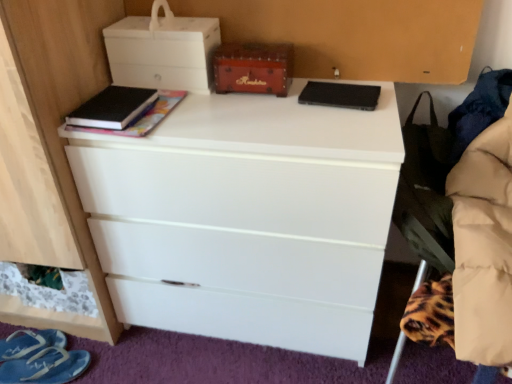
Find the location of a particular element. This screenshot has height=384, width=512. white matte storage box at upper left, which is counted as the first storage box, starting from the left is located at coordinates (162, 50).

How much space does blue fabric slipper at lower left, which is the 1th footwear in front-to-back order, occupy vertically?

4.83 centimeters.

This screenshot has width=512, height=384. Describe the element at coordinates (113, 108) in the screenshot. I see `black matte book at upper left, which ranks as the first book in left-to-right order` at that location.

Locate an element on the screen. The width and height of the screenshot is (512, 384). black matte book at upper left, acting as the 2th book starting from the right is located at coordinates (113, 108).

Identify the location of black fabric swivel chair at right. This screenshot has height=384, width=512. (440, 193).

Image resolution: width=512 pixels, height=384 pixels. Describe the element at coordinates (253, 68) in the screenshot. I see `wooden chest at center, marked as the second storage box in a left-to-right arrangement` at that location.

Locate an element on the screen. This screenshot has width=512, height=384. white matte storage box at upper left, positioned as the second storage box in right-to-left order is located at coordinates (162, 50).

Who is shorter, blue fabric slipper at lower left, positioned as the 2th footwear in back-to-front order, or wooden chest at center, placed as the 1th storage box when sorted from right to left?

blue fabric slipper at lower left, positioned as the 2th footwear in back-to-front order, is shorter.

Is there a large distance between blue fabric slipper at lower left, positioned as the 2th footwear in back-to-front order, and wooden chest at center, marked as the second storage box in a left-to-right arrangement?

Yes, blue fabric slipper at lower left, positioned as the 2th footwear in back-to-front order, is far from wooden chest at center, marked as the second storage box in a left-to-right arrangement.

Does blue fabric slipper at lower left, which is the 1th footwear in front-to-back order, come behind wooden chest at center, marked as the second storage box in a left-to-right arrangement?

Yes, it is behind wooden chest at center, marked as the second storage box in a left-to-right arrangement.

Is white matte storage box at upper left, which is counted as the first storage box, starting from the left, in contact with black matte book at upper left, which ranks as the first book in left-to-right order?

No, white matte storage box at upper left, which is counted as the first storage box, starting from the left, is not with black matte book at upper left, which ranks as the first book in left-to-right order.

The image size is (512, 384). Identify the location of the 1st storage box counting from the right side of the black matte book at upper left, which ranks as the first book in left-to-right order. (162, 50).

What's the angular difference between white matte storage box at upper left, positioned as the second storage box in right-to-left order, and black matte book at upper left, acting as the 2th book starting from the right,'s facing directions?

The angle between the facing direction of white matte storage box at upper left, positioned as the second storage box in right-to-left order, and the facing direction of black matte book at upper left, acting as the 2th book starting from the right, is 3.16 degrees.

Which is farther, (142, 59) or (133, 120)?

The point (142, 59) is farther from the camera.

What's the angular difference between black matte book at upper left, acting as the 2th book starting from the right, and blue fabric slipper at lower left, which is the 1th footwear in front-to-back order,'s facing directions?

The facing directions of black matte book at upper left, acting as the 2th book starting from the right, and blue fabric slipper at lower left, which is the 1th footwear in front-to-back order, are 106 degrees apart.

Does black matte book at upper left, acting as the 2th book starting from the right, touch blue fabric slipper at lower left, which is the 1th footwear in front-to-back order?

black matte book at upper left, acting as the 2th book starting from the right, and blue fabric slipper at lower left, which is the 1th footwear in front-to-back order, are not in contact.

Considering the relative sizes of black matte book at upper left, acting as the 2th book starting from the right, and blue fabric slipper at lower left, positioned as the 2th footwear in back-to-front order, in the image provided, is black matte book at upper left, acting as the 2th book starting from the right, shorter than blue fabric slipper at lower left, positioned as the 2th footwear in back-to-front order,?

Yes.

From a real-world perspective, which object stands above the other?

From a 3D spatial view, black matte book at upper left, acting as the 2th book starting from the right, is above.

How many degrees apart are the facing directions of blue fabric sandal at lower left, the first footwear positioned from the back, and black matte speaker at upper center, placed as the first book when sorted from right to left?

The angular difference between blue fabric sandal at lower left, the first footwear positioned from the back, and black matte speaker at upper center, placed as the first book when sorted from right to left, is 120 degrees.

From a real-world perspective, is blue fabric sandal at lower left, which ranks as the 2th footwear in front-to-back order, positioned under black matte speaker at upper center, placed as the first book when sorted from right to left, based on gravity?

Yes, from a real-world perspective, blue fabric sandal at lower left, which ranks as the 2th footwear in front-to-back order, is below black matte speaker at upper center, placed as the first book when sorted from right to left.

Is blue fabric sandal at lower left, the first footwear positioned from the back, beside black matte speaker at upper center, the second book viewed from the left?

There is a gap between blue fabric sandal at lower left, the first footwear positioned from the back, and black matte speaker at upper center, the second book viewed from the left.

Is blue fabric sandal at lower left, which ranks as the 2th footwear in front-to-back order, situated inside black matte speaker at upper center, the second book viewed from the left, or outside?

The correct answer is: outside.

Considering the relative positions of white matte chest of drawers at center and blue fabric sandal at lower left, which ranks as the 2th footwear in front-to-back order, in the image provided, is white matte chest of drawers at center in front of blue fabric sandal at lower left, which ranks as the 2th footwear in front-to-back order,?

Yes, the depth of white matte chest of drawers at center is less than that of blue fabric sandal at lower left, which ranks as the 2th footwear in front-to-back order.

From the image's perspective, does white matte chest of drawers at center appear lower than blue fabric sandal at lower left, which ranks as the 2th footwear in front-to-back order?

Incorrect, from the image's perspective, white matte chest of drawers at center is higher than blue fabric sandal at lower left, which ranks as the 2th footwear in front-to-back order.

The width and height of the screenshot is (512, 384). In the image, there is a blue fabric sandal at lower left, the first footwear positioned from the back. Identify the location of the chest of drawers above it (from the image's perspective). (247, 218).

How far apart are white matte chest of drawers at center and blue fabric sandal at lower left, which ranks as the 2th footwear in front-to-back order?

white matte chest of drawers at center and blue fabric sandal at lower left, which ranks as the 2th footwear in front-to-back order, are 29.30 inches apart from each other.

Locate an element on the screen. This screenshot has height=384, width=512. footwear on the right of blue fabric sandal at lower left, which ranks as the 2th footwear in front-to-back order is located at coordinates 46,367.

Choose the correct answer: Is blue fabric slipper at lower left, positioned as the 2th footwear in back-to-front order, inside blue fabric sandal at lower left, the first footwear positioned from the back, or outside it?

blue fabric slipper at lower left, positioned as the 2th footwear in back-to-front order, exists outside the volume of blue fabric sandal at lower left, the first footwear positioned from the back.

From the image's perspective, relative to blue fabric sandal at lower left, the first footwear positioned from the back, is blue fabric slipper at lower left, which is the 1th footwear in front-to-back order, above or below?

Based on their image positions, blue fabric slipper at lower left, which is the 1th footwear in front-to-back order, is located beneath blue fabric sandal at lower left, the first footwear positioned from the back.

Is point (66, 373) farther from camera compared to point (44, 341)?

No, it is in front of (44, 341).

Is white matte chest of drawers at center completely or partially outside of white matte storage box at upper left, positioned as the second storage box in right-to-left order?

Yes, white matte chest of drawers at center is outside of white matte storage box at upper left, positioned as the second storage box in right-to-left order.

Is white matte chest of drawers at center positioned behind white matte storage box at upper left, which is counted as the first storage box, starting from the left?

No, white matte chest of drawers at center is closer to the camera.

Are white matte chest of drawers at center and white matte storage box at upper left, which is counted as the first storage box, starting from the left, making contact?

No, white matte chest of drawers at center is not with white matte storage box at upper left, which is counted as the first storage box, starting from the left.

At what (x,y) coordinates should I click in order to perform the action: click on the chest of drawers in front of the white matte storage box at upper left, positioned as the second storage box in right-to-left order. Please return your answer as a coordinate pair (x, y). The height and width of the screenshot is (384, 512). Looking at the image, I should click on (247, 218).

Which storage box is the 2nd one when counting from the right side of the blue fabric slipper at lower left, positioned as the 2th footwear in back-to-front order? Please provide its 2D coordinates.

[(253, 68)]

Where is `book to the left of white matte storage box at upper left, positioned as the second storage box in right-to-left order`? This screenshot has width=512, height=384. book to the left of white matte storage box at upper left, positioned as the second storage box in right-to-left order is located at coordinates (113, 108).

Estimate the real-world distances between objects in this image. Which object is further from black matte speaker at upper center, the second book viewed from the left, black matte book at upper left, which ranks as the first book in left-to-right order, or black fabric swivel chair at right?

black matte book at upper left, which ranks as the first book in left-to-right order.

When comparing their distances from blue fabric slipper at lower left, positioned as the 2th footwear in back-to-front order, does black matte book at upper left, which ranks as the first book in left-to-right order, or wooden chest at center, placed as the 1th storage box when sorted from right to left, seem closer?

black matte book at upper left, which ranks as the first book in left-to-right order.

Estimate the real-world distances between objects in this image. Which object is further from blue fabric slipper at lower left, which is the 1th footwear in front-to-back order, black fabric swivel chair at right or wooden chest at center, marked as the second storage box in a left-to-right arrangement?

black fabric swivel chair at right lies further to blue fabric slipper at lower left, which is the 1th footwear in front-to-back order, than the other object.

From the image, which object appears to be farther from white matte storage box at upper left, positioned as the second storage box in right-to-left order, wooden chest at center, placed as the 1th storage box when sorted from right to left, or black fabric swivel chair at right?

black fabric swivel chair at right lies further to white matte storage box at upper left, positioned as the second storage box in right-to-left order, than the other object.

Looking at the image, which one is located closer to blue fabric sandal at lower left, which ranks as the 2th footwear in front-to-back order, black fabric swivel chair at right or white matte storage box at upper left, positioned as the second storage box in right-to-left order?

white matte storage box at upper left, positioned as the second storage box in right-to-left order, is closer to blue fabric sandal at lower left, which ranks as the 2th footwear in front-to-back order.

Looking at the image, which one is located closer to white matte storage box at upper left, positioned as the second storage box in right-to-left order, black fabric swivel chair at right or white matte chest of drawers at center?

white matte chest of drawers at center is positioned closer to the anchor white matte storage box at upper left, positioned as the second storage box in right-to-left order.

Which object lies nearer to the anchor point black matte book at upper left, acting as the 2th book starting from the right, blue fabric sandal at lower left, the first footwear positioned from the back, or blue fabric slipper at lower left, which is the 1th footwear in front-to-back order?

The object closer to black matte book at upper left, acting as the 2th book starting from the right, is blue fabric slipper at lower left, which is the 1th footwear in front-to-back order.

Based on their spatial positions, is blue fabric sandal at lower left, the first footwear positioned from the back, or black fabric swivel chair at right closer to white matte chest of drawers at center?

Based on the image, black fabric swivel chair at right appears to be nearer to white matte chest of drawers at center.

Identify the location of footwear between blue fabric sandal at lower left, the first footwear positioned from the back, and white matte chest of drawers at center, in the horizontal direction. (46, 367).

The width and height of the screenshot is (512, 384). What are the coordinates of `storage box between white matte storage box at upper left, positioned as the second storage box in right-to-left order, and white matte chest of drawers at center in the up-down direction` in the screenshot? It's located at (253, 68).

This screenshot has width=512, height=384. Identify the location of chest of drawers between white matte storage box at upper left, positioned as the second storage box in right-to-left order, and black fabric swivel chair at right. (247, 218).

At what (x,y) coordinates should I click in order to perform the action: click on chest of drawers between black matte book at upper left, acting as the 2th book starting from the right, and black matte speaker at upper center, the second book viewed from the left. Please return your answer as a coordinate pair (x, y). Looking at the image, I should click on (247, 218).